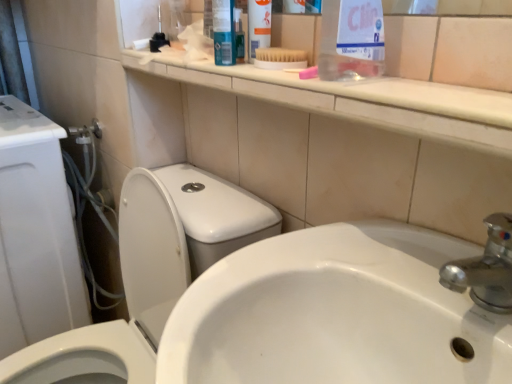
Question: Considering the relative sizes of white plastic brush at upper center and white glossy toilet at left in the image provided, is white plastic brush at upper center shorter than white glossy toilet at left?

Choices:
 (A) yes
 (B) no

Answer: (A)

Question: Considering the relative positions of white plastic brush at upper center and white glossy toilet at left in the image provided, is white plastic brush at upper center to the left of white glossy toilet at left from the viewer's perspective?

Choices:
 (A) no
 (B) yes

Answer: (A)

Question: From a real-world perspective, is white plastic brush at upper center physically below white glossy toilet at left?

Choices:
 (A) no
 (B) yes

Answer: (A)

Question: Is white plastic brush at upper center aimed at white glossy toilet at left?

Choices:
 (A) yes
 (B) no

Answer: (B)

Question: Can you confirm if white plastic brush at upper center is smaller than white glossy toilet at left?

Choices:
 (A) no
 (B) yes

Answer: (B)

Question: In terms of height, does white glossy toilet at left look taller or shorter compared to clear plastic bottle at upper center?

Choices:
 (A) short
 (B) tall

Answer: (B)

Question: Is point (56, 297) closer or farther from the camera than point (368, 43)?

Choices:
 (A) farther
 (B) closer

Answer: (A)

Question: From the image's perspective, is white glossy toilet at left above or below clear plastic bottle at upper center?

Choices:
 (A) above
 (B) below

Answer: (B)

Question: In the image, is white glossy toilet at left positioned in front of or behind clear plastic bottle at upper center?

Choices:
 (A) front
 (B) behind

Answer: (B)

Question: From a real-world perspective, relative to clear plastic bottle at upper center, is white plastic brush at upper center vertically above or below?

Choices:
 (A) below
 (B) above

Answer: (A)

Question: Considering their positions, is white plastic brush at upper center located in front of or behind clear plastic bottle at upper center?

Choices:
 (A) behind
 (B) front

Answer: (A)

Question: Is white plastic brush at upper center situated inside clear plastic bottle at upper center or outside?

Choices:
 (A) inside
 (B) outside

Answer: (B)

Question: From the image's perspective, is white plastic brush at upper center positioned above or below clear plastic bottle at upper center?

Choices:
 (A) below
 (B) above

Answer: (B)

Question: Is point (161, 226) positioned closer to the camera than point (262, 3)?

Choices:
 (A) farther
 (B) closer

Answer: (A)

Question: From the image's perspective, is white glossy toilet at left above or below white plastic brush at upper center?

Choices:
 (A) above
 (B) below

Answer: (B)